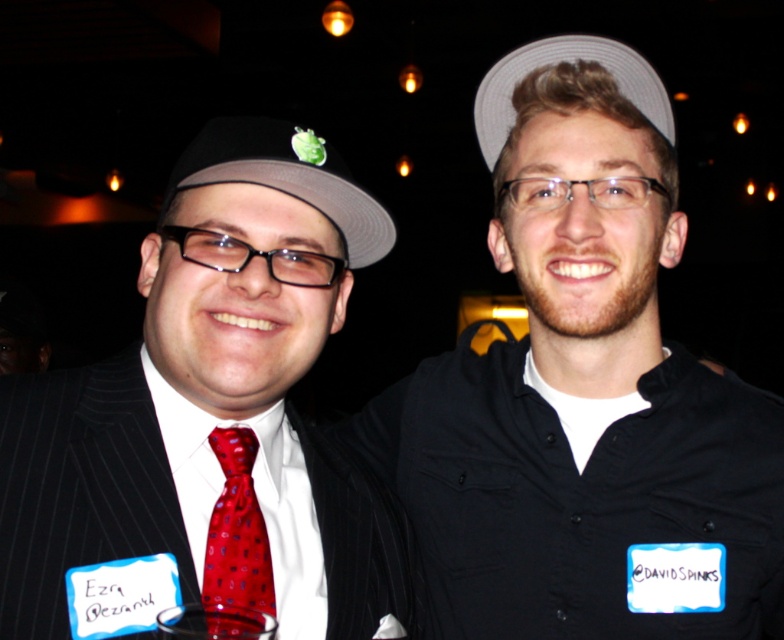
You are taking a photo of two points in the image. The first point is at coordinate point [256,508] and the second point is at coordinate point [481,116]. Which point is closer to the camera?

Point [256,508] is closer to the camera than point [481,116].

You are a photographer at the event and want to ensure the shiny red tie at center and the white fabric baseball hat at upper center are both visible in the photo. Which object should you adjust to avoid covering the other?

The shiny red tie at center is positioned under the white fabric baseball hat at upper center. To ensure both are visible, you should adjust the white fabric baseball hat at upper center to move it upwards or tilt it slightly so it doesn